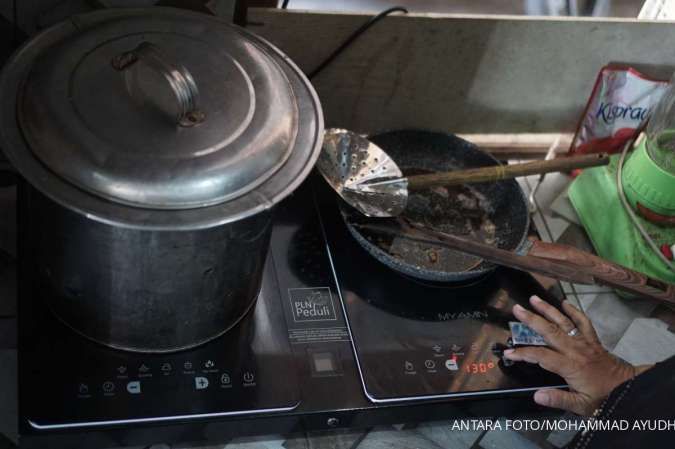
The width and height of the screenshot is (675, 449). I want to click on stockpot with lid, so click(161, 288).